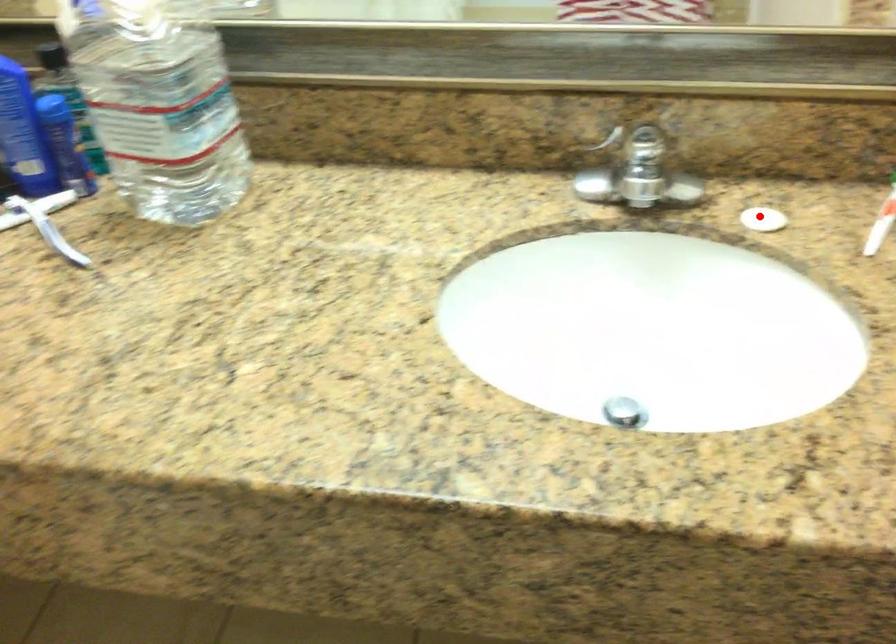
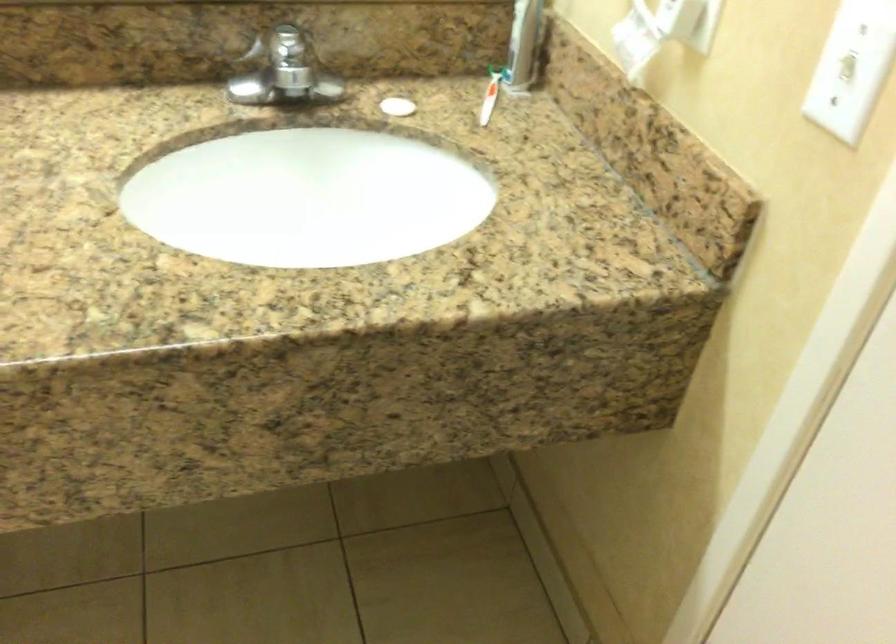
Where in the second image is the point corresponding to the highlighted location from the first image?

(398, 106)